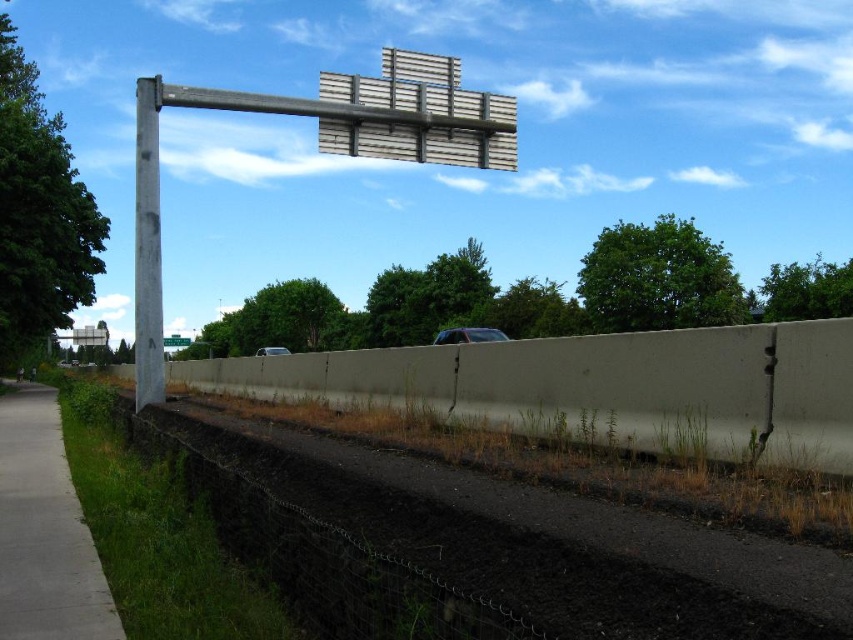
Consider the image. You are standing at the point with coordinates 0.5, 0.5 in the image. You want to walk towards the shiny black car at center. In which direction should you move?

Since the shiny black car at center is located at point (468, 336), which is slightly to the right and above your current position at (426, 320), you should move northeast to reach it.